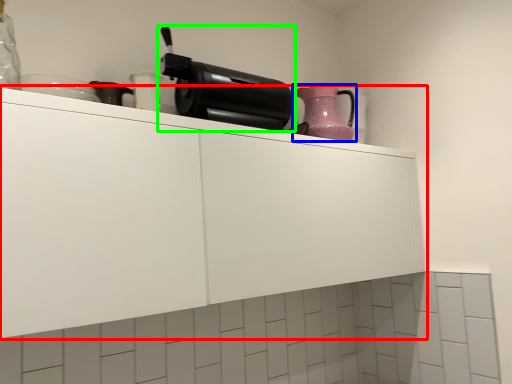
Question: Considering the real-world distances, which object is closest to cabinetry (highlighted by a red box)? kitchen appliance (highlighted by a blue box) or home appliance (highlighted by a green box).

Choices:
 (A) kitchen appliance
 (B) home appliance

Answer: (B)